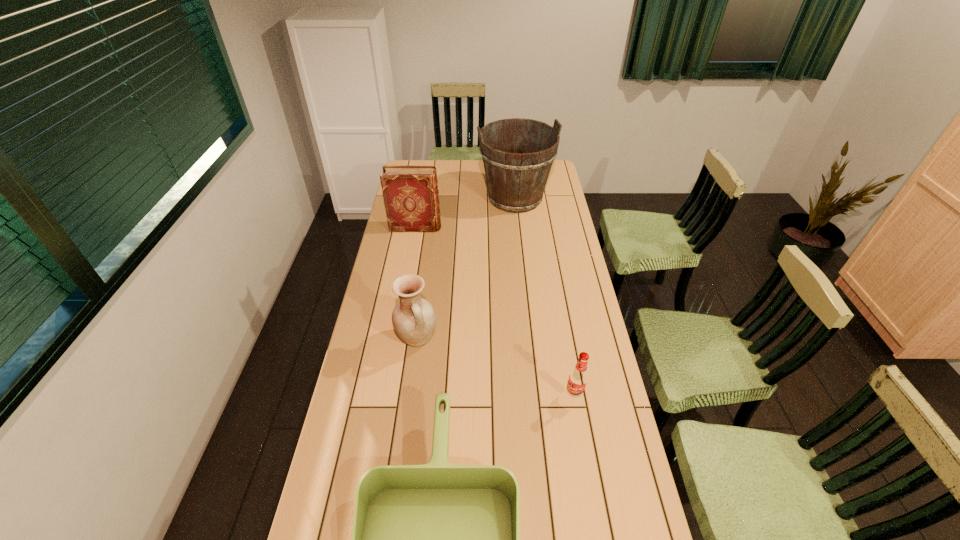
Locate an element on the screen. the tallest object is located at coordinates (516, 181).

Image resolution: width=960 pixels, height=540 pixels. Find the location of `the farthest object`. the farthest object is located at coordinates (516, 181).

Where is `the fourth nearest object`? The image size is (960, 540). the fourth nearest object is located at coordinates (410, 193).

What are the coordinates of `pottery` in the screenshot? It's located at (413, 318).

Locate an element on the screen. This screenshot has height=540, width=960. root beer is located at coordinates (578, 378).

The image size is (960, 540). What are the coordinates of `the fourth tallest object` in the screenshot? It's located at (578, 378).

This screenshot has width=960, height=540. Identify the location of blank space located 0.300m on the left of the tallest object. 417,199.

This screenshot has width=960, height=540. What are the coordinates of `free space located 0.370m on the spine side of the fourth nearest object` in the screenshot? It's located at (522, 227).

Where is `vacant area situated 0.230m on the front of the pottery`? vacant area situated 0.230m on the front of the pottery is located at coordinates (406, 418).

The image size is (960, 540). I want to click on vacant space located 0.310m on the back of the root beer, so click(x=560, y=315).